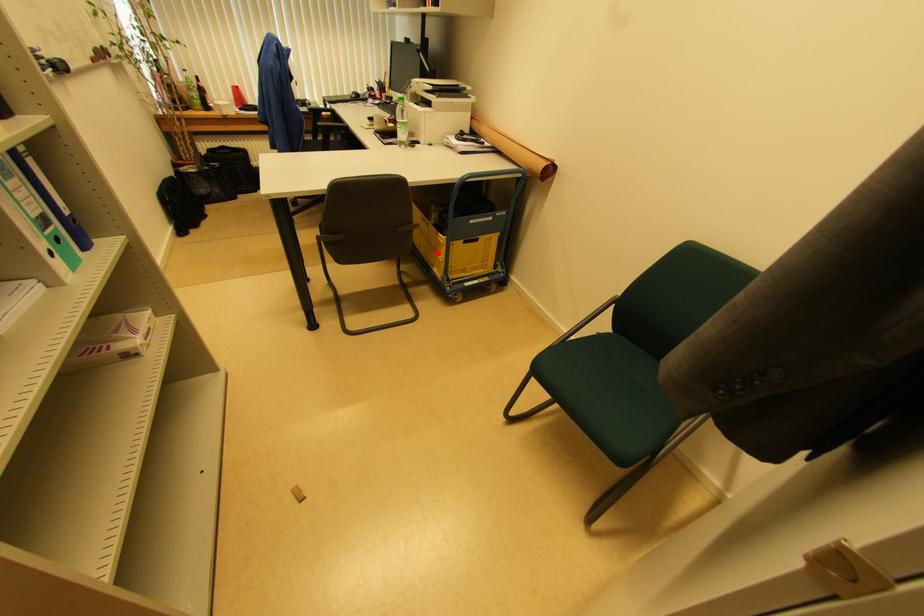
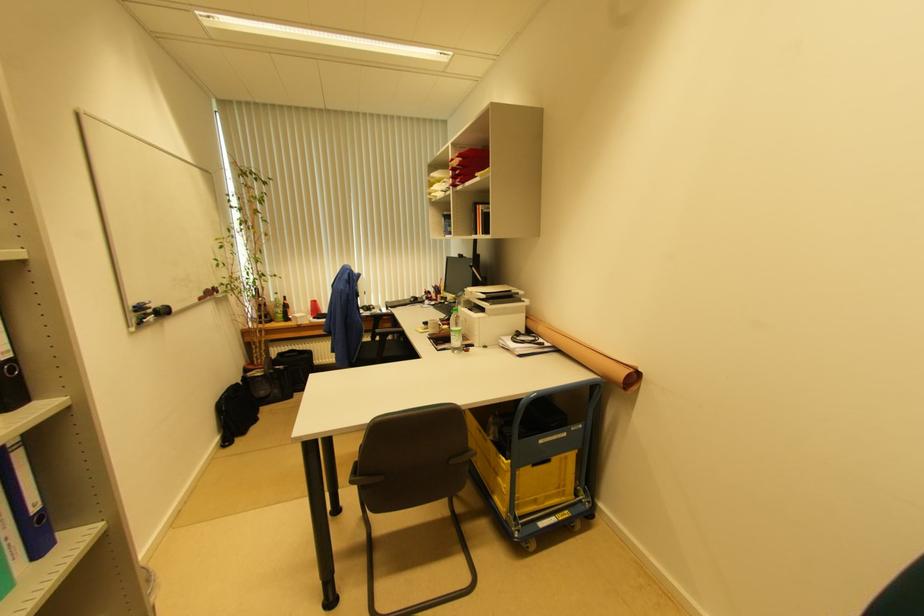
In the second image, find the point that corresponds to the highlighted location in the first image.

(499, 477)